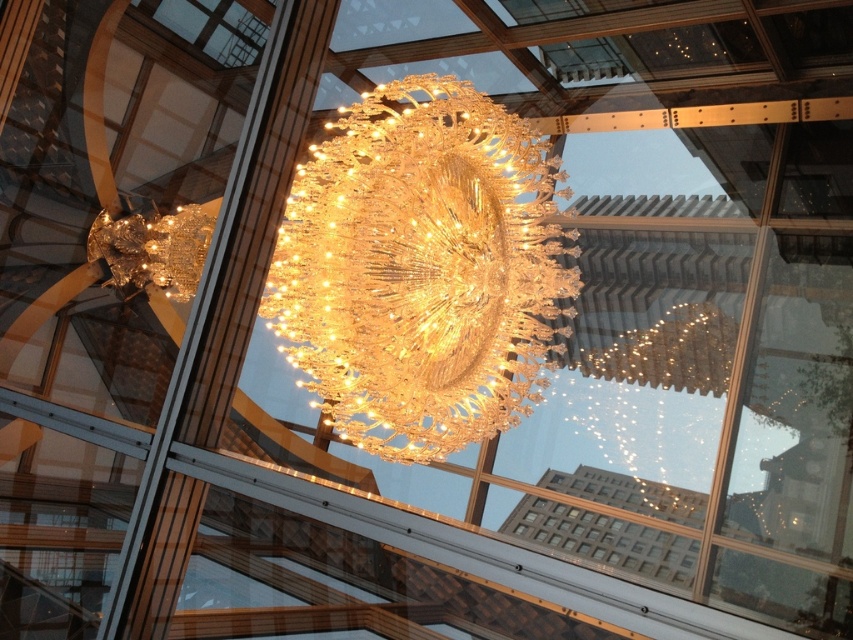
Is crystal glass chandelier at center further to the viewer compared to gold crystal chandelier at upper center?

No, it is not.

In the scene shown: Can you confirm if crystal glass chandelier at center is shorter than gold crystal chandelier at upper center?

In fact, crystal glass chandelier at center may be taller than gold crystal chandelier at upper center.

Which is behind, point (421, 444) or point (143, 250)?

Point (143, 250)

At what (x,y) coordinates should I click in order to perform the action: click on crystal glass chandelier at center. Please return your answer as a coordinate pair (x, y). The image size is (853, 640). Looking at the image, I should click on click(x=421, y=269).